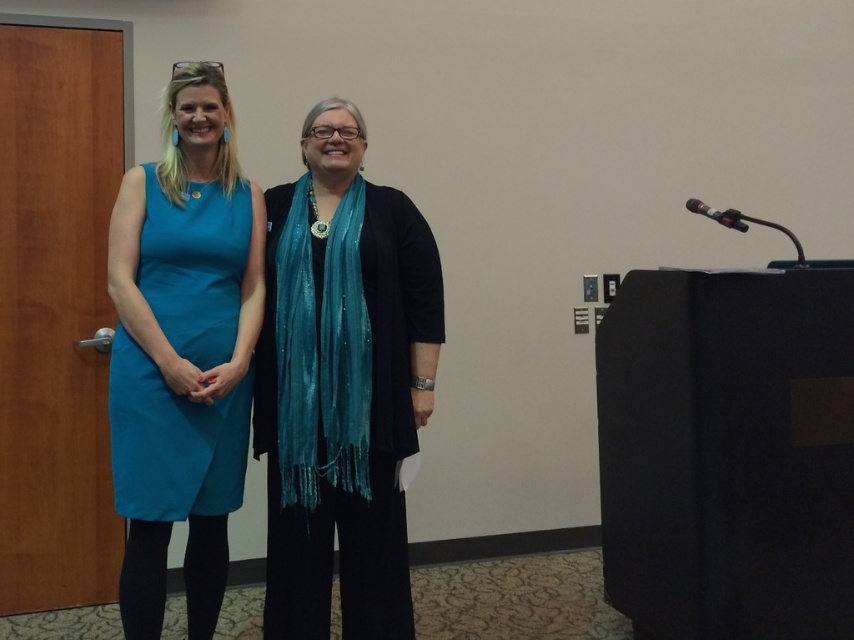
Question: Which is nearer to the teal shimmering scarf at center?

Choices:
 (A) shiny teal scarf at center
 (B) teal fabric dress at left

Answer: (A)

Question: Is shiny teal scarf at center smaller than teal shimmering scarf at center?

Choices:
 (A) yes
 (B) no

Answer: (B)

Question: Can you confirm if shiny teal scarf at center is wider than teal fabric dress at left?

Choices:
 (A) no
 (B) yes

Answer: (B)

Question: Among these points, which one is farthest from the camera?

Choices:
 (A) (208, 445)
 (B) (303, 268)
 (C) (267, 260)

Answer: (C)

Question: Based on their relative distances, which object is farther from the shiny teal scarf at center?

Choices:
 (A) teal fabric dress at left
 (B) teal shimmering scarf at center

Answer: (A)

Question: Does shiny teal scarf at center have a lesser width compared to teal fabric dress at left?

Choices:
 (A) yes
 (B) no

Answer: (B)